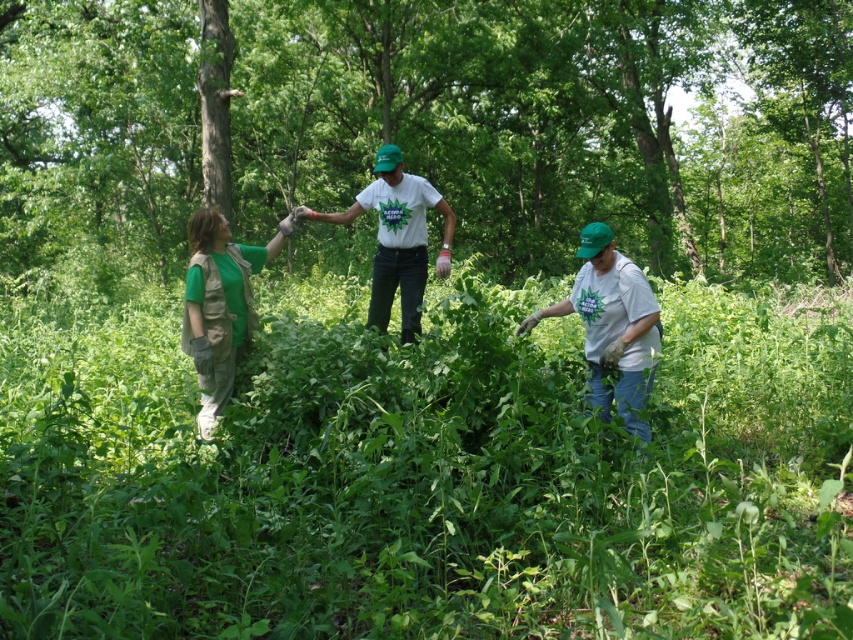
Question: Does green leafy vegetation at center have a greater width compared to white matte t-shirt at center?

Choices:
 (A) no
 (B) yes

Answer: (B)

Question: Which of the following is the farthest from the observer?

Choices:
 (A) green matte vest at left
 (B) white matte shirt at lower right
 (C) green leafy vegetation at center
 (D) white matte t-shirt at center

Answer: (D)

Question: Can you confirm if green leafy tree at center is positioned above white matte shirt at lower right?

Choices:
 (A) no
 (B) yes

Answer: (B)

Question: Does green leafy tree at center come in front of green matte vest at left?

Choices:
 (A) no
 (B) yes

Answer: (A)

Question: Which object appears farthest from the camera in this image?

Choices:
 (A) white matte t-shirt at center
 (B) green matte vest at left
 (C) white matte shirt at lower right
 (D) green leafy tree at center

Answer: (D)

Question: Which of the following is the farthest from the observer?

Choices:
 (A) white matte t-shirt at center
 (B) white matte shirt at lower right
 (C) green matte vest at left
 (D) green leafy vegetation at center

Answer: (A)